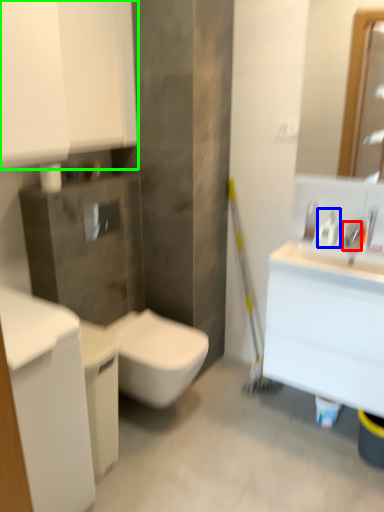
Question: Considering the real-world distances, which object is closest to faucet (highlighted by a red box)? cleaning product (highlighted by a blue box) or bathroom cabinet (highlighted by a green box).

Choices:
 (A) cleaning product
 (B) bathroom cabinet

Answer: (A)